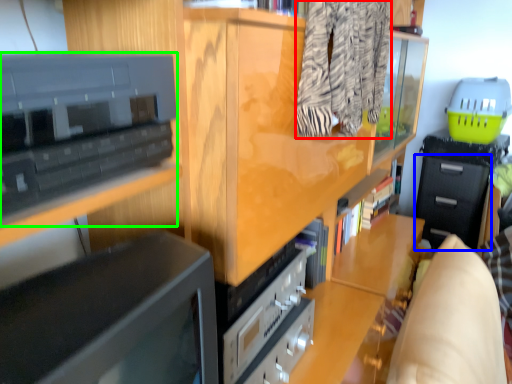
Question: Based on their relative distances, which object is farther from clothing (highlighted by a red box)? Choose from drawer (highlighted by a blue box) and cabinetry (highlighted by a green box).

Choices:
 (A) drawer
 (B) cabinetry

Answer: (A)